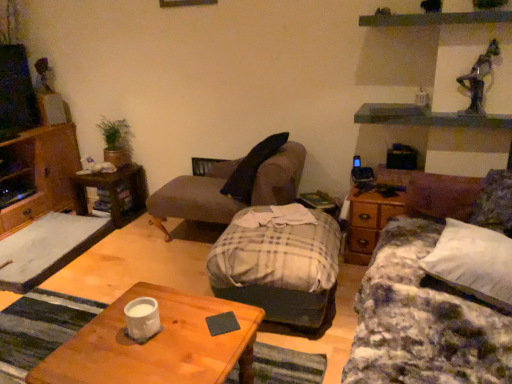
Question: Which direction should I rotate to look at plaid fabric studio couch at center, which is counted as the 2th studio couch, starting from the right, — up or down?

Choices:
 (A) down
 (B) up

Answer: (A)

Question: From a real-world perspective, is wooden coffee table at center positioned over plush brown chaise at center based on gravity?

Choices:
 (A) yes
 (B) no

Answer: (B)

Question: From the image's perspective, is wooden coffee table at center on plush brown chaise at center?

Choices:
 (A) no
 (B) yes

Answer: (A)

Question: Is wooden coffee table at center shorter than plush brown chaise at center?

Choices:
 (A) yes
 (B) no

Answer: (A)

Question: Can you confirm if wooden coffee table at center is smaller than plush brown chaise at center?

Choices:
 (A) yes
 (B) no

Answer: (A)

Question: Is wooden coffee table at center bigger than plush brown chaise at center?

Choices:
 (A) no
 (B) yes

Answer: (A)

Question: Considering the relative sizes of wooden coffee table at center and plush brown chaise at center in the image provided, is wooden coffee table at center thinner than plush brown chaise at center?

Choices:
 (A) no
 (B) yes

Answer: (A)

Question: From the image's perspective, does plaid fabric studio couch at center, which is counted as the 2th studio couch, starting from the right, appear higher than wooden cabinet at left?

Choices:
 (A) yes
 (B) no

Answer: (B)

Question: Is plaid fabric studio couch at center, which is counted as the 2th studio couch, starting from the right, shorter than wooden cabinet at left?

Choices:
 (A) no
 (B) yes

Answer: (B)

Question: Is plaid fabric studio couch at center, which is the 1th studio couch in left-to-right order, bigger than wooden cabinet at left?

Choices:
 (A) no
 (B) yes

Answer: (A)

Question: Is plaid fabric studio couch at center, which is counted as the 2th studio couch, starting from the right, turned away from wooden cabinet at left?

Choices:
 (A) no
 (B) yes

Answer: (A)

Question: Is plaid fabric studio couch at center, which is counted as the 2th studio couch, starting from the right, smaller than wooden cabinet at left?

Choices:
 (A) yes
 (B) no

Answer: (A)

Question: From a real-world perspective, is plaid fabric studio couch at center, which is the 1th studio couch in left-to-right order, below wooden cabinet at left?

Choices:
 (A) yes
 (B) no

Answer: (A)

Question: Is plaid fabric studio couch at center, which is the 1th studio couch in left-to-right order, aimed at plaid fabric studio couch at center, the first studio couch in the right-to-left sequence?

Choices:
 (A) yes
 (B) no

Answer: (B)